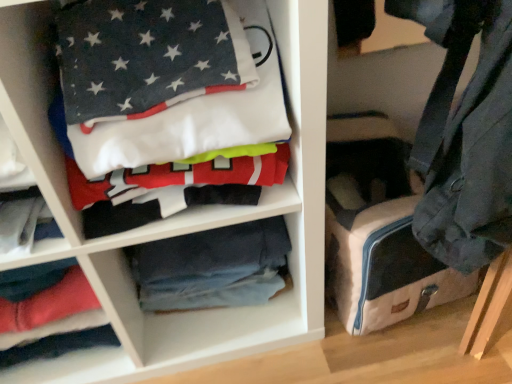
Question: Is canvas suitcase at lower right at the left side of blue denim jeans at center?

Choices:
 (A) yes
 (B) no

Answer: (B)

Question: Does canvas suitcase at lower right touch blue denim jeans at center?

Choices:
 (A) no
 (B) yes

Answer: (A)

Question: From the image's perspective, is canvas suitcase at lower right below blue denim jeans at center?

Choices:
 (A) yes
 (B) no

Answer: (B)

Question: From the image's perspective, does canvas suitcase at lower right appear higher than blue denim jeans at center?

Choices:
 (A) yes
 (B) no

Answer: (A)

Question: Considering the relative sizes of canvas suitcase at lower right and blue denim jeans at center in the image provided, is canvas suitcase at lower right bigger than blue denim jeans at center?

Choices:
 (A) yes
 (B) no

Answer: (A)

Question: Could you tell me if canvas suitcase at lower right is facing blue denim jeans at center?

Choices:
 (A) yes
 (B) no

Answer: (B)

Question: Is blue denim jeans at center facing away from canvas suitcase at lower right?

Choices:
 (A) yes
 (B) no

Answer: (B)

Question: From a real-world perspective, does blue denim jeans at center stand above canvas suitcase at lower right?

Choices:
 (A) yes
 (B) no

Answer: (B)

Question: Is blue denim jeans at center aimed at canvas suitcase at lower right?

Choices:
 (A) yes
 (B) no

Answer: (B)

Question: Would you say canvas suitcase at lower right is part of blue denim jeans at center's contents?

Choices:
 (A) no
 (B) yes

Answer: (A)

Question: Does blue denim jeans at center lie in front of canvas suitcase at lower right?

Choices:
 (A) no
 (B) yes

Answer: (A)

Question: Is blue denim jeans at center at the left side of canvas suitcase at lower right?

Choices:
 (A) yes
 (B) no

Answer: (A)

Question: Is blue denim jeans at center far from dark blue cotton t-shirt at upper left?

Choices:
 (A) no
 (B) yes

Answer: (A)